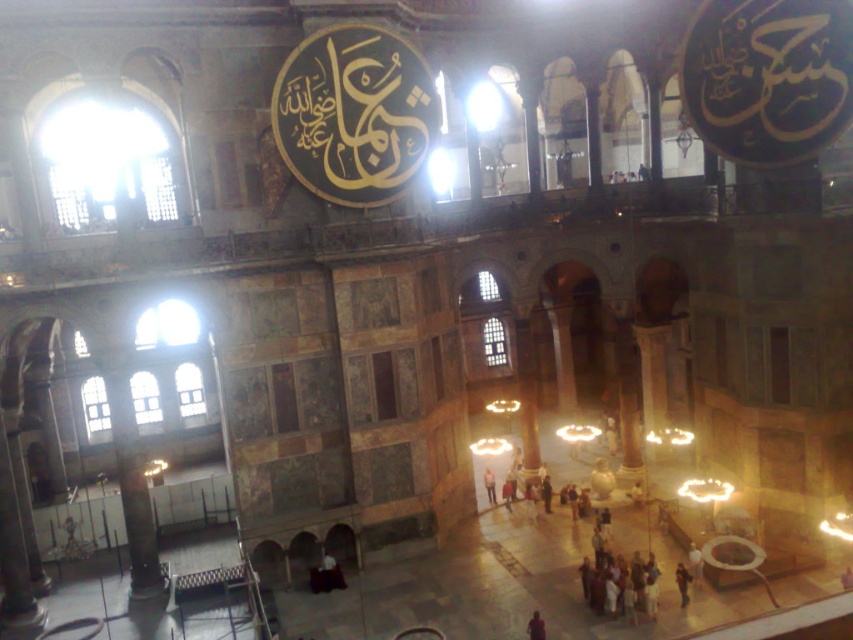
You are an interior designer planning to place two leather jackets in the grand historical building. The jackets are the dark brown leather jacket at lower center and the light brown leather jacket at center. Given their sizes, which one would you recommend placing in a wider display area to accommodate its size?

The dark brown leather jacket at lower center has a larger width than the light brown leather jacket at center, so it should be placed in the wider display area to accommodate its size.

You are a tour guide leading a group through this historical mosque. You notice two leather jackets left behind by visitors. The jackets are the dark brown leather jacket at lower center and the light brown leather jacket at center. You need to retrieve them both. How far apart are these two jackets?

The dark brown leather jacket at lower center and the light brown leather jacket at center are 50.74 feet apart.